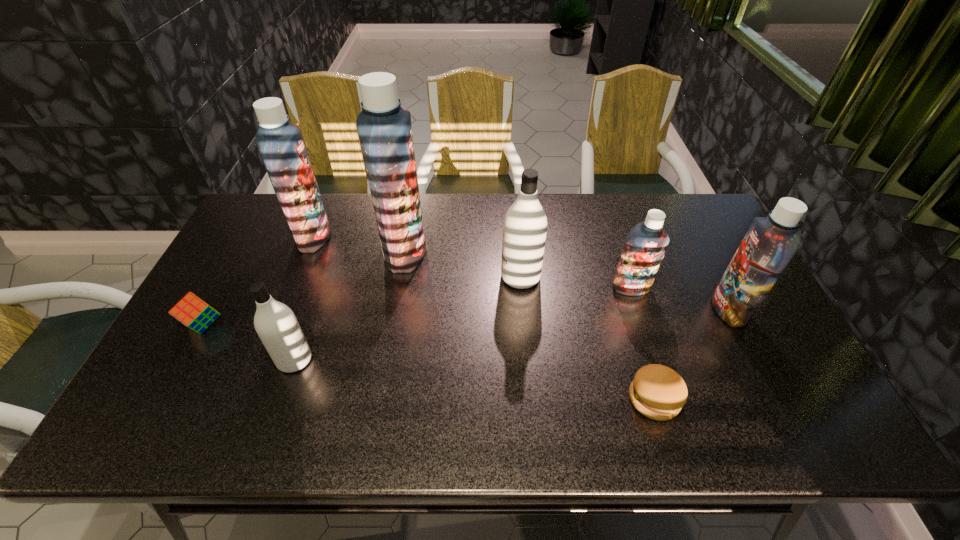
In order to click on object that is at the right edge in this screenshot , I will do `click(770, 243)`.

In the image, there is a desktop. At what (x,y) coordinates should I click in order to perform the action: click on vacant space at the far edge. Please return your answer as a coordinate pair (x, y). Looking at the image, I should click on (623, 226).

You are a GUI agent. You are given a task and a screenshot of the screen. Output one action in this format:
    pyautogui.click(x=<x>, y=<y>)
    Task: Click on the vacant space at the left edge of the desktop
    
    Given the screenshot: What is the action you would take?
    pyautogui.click(x=210, y=361)

Where is `blank space at the right edge of the desktop`? The width and height of the screenshot is (960, 540). blank space at the right edge of the desktop is located at coordinates (750, 323).

I want to click on vacant region at the far right corner of the desktop, so click(675, 200).

At what (x,y) coordinates should I click in order to perform the action: click on free space at the near right corner of the desktop. Please return your answer as a coordinate pair (x, y). This screenshot has height=540, width=960. Looking at the image, I should click on pyautogui.click(x=831, y=440).

The image size is (960, 540). In order to click on unoccupied position between the shortest object and the tallest object in this screenshot , I will do `click(530, 325)`.

You are a GUI agent. You are given a task and a screenshot of the screen. Output one action in this format:
    pyautogui.click(x=<x>, y=<y>)
    Task: Click on the vacant space that's between the brown hamburger and the rightmost object
    The image size is (960, 540).
    Given the screenshot: What is the action you would take?
    pyautogui.click(x=691, y=354)

Find the location of a particular element. free space between the hamburger and the fifth shortest shampoo is located at coordinates (484, 318).

This screenshot has height=540, width=960. In order to click on vacant point located between the rightmost shampoo and the smallest blue shampoo in this screenshot , I will do `click(680, 299)`.